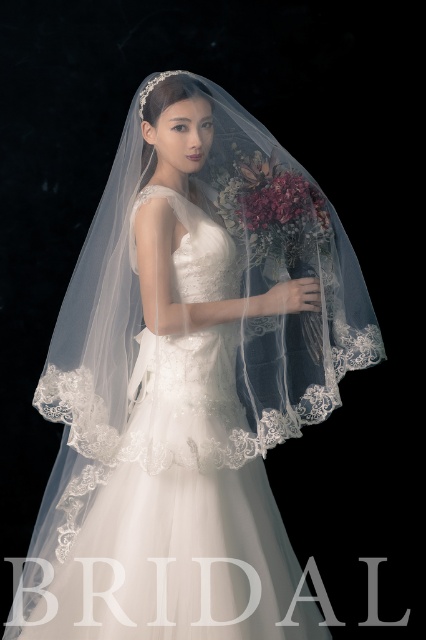
Describe the element at coordinates (273, 211) in the screenshot. I see `velvet floral bouquet at center` at that location.

Between point (319, 246) and point (287, 220), which one is positioned in front?

Point (287, 220) is more forward.

Is point (227, 182) farther from viewer compared to point (256, 224)?

Yes, it is behind point (256, 224).

At what (x,y) coordinates should I click in order to perform the action: click on velvet floral bouquet at center. Please return your answer as a coordinate pair (x, y). The height and width of the screenshot is (640, 426). Looking at the image, I should click on (273, 211).

Does point (181, 269) lie behind point (259, 189)?

Yes, point (181, 269) is farther from viewer.

What do you see at coordinates (158, 506) in the screenshot?
I see `white lace dress at center` at bounding box center [158, 506].

Find the location of a particular element. white lace dress at center is located at coordinates (x=158, y=506).

In the scene shown: Is white lace dress at center to the right of deep burgundy silk bouquet at center from the viewer's perspective?

In fact, white lace dress at center is to the left of deep burgundy silk bouquet at center.

Identify the location of white lace dress at center. (x=158, y=506).

Is point (45, 579) positioned behind point (276, 209)?

Yes, it is behind point (276, 209).

Identify the location of white lace dress at center. (158, 506).